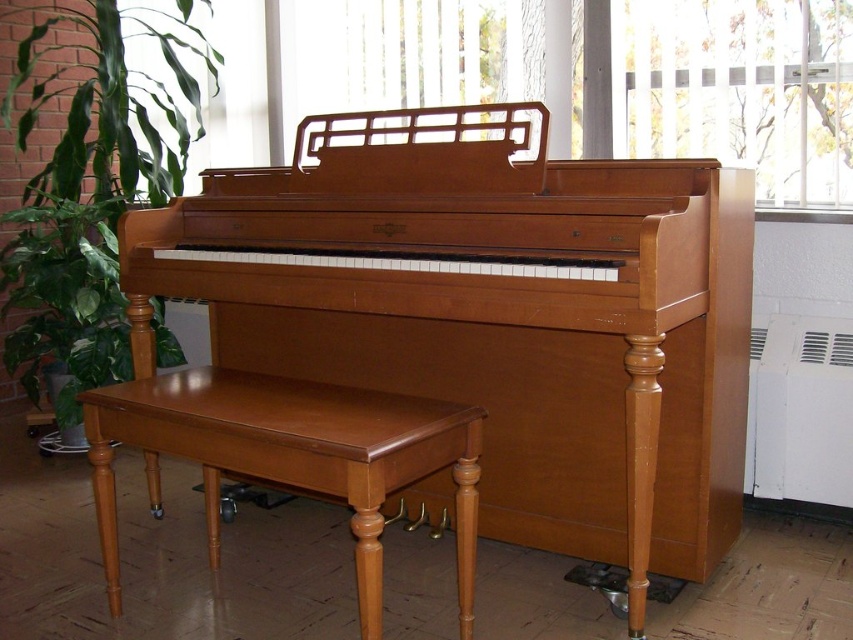
Question: Can you confirm if light brown polished wood piano at center is positioned above brown leather stool at lower left?

Choices:
 (A) yes
 (B) no

Answer: (A)

Question: Among these objects, which one is farthest from the camera?

Choices:
 (A) light brown polished wood piano at center
 (B) green leafy plant at left

Answer: (B)

Question: Is light brown polished wood piano at center further to camera compared to green leafy plant at left?

Choices:
 (A) no
 (B) yes

Answer: (A)

Question: Is green leafy plant at left further to the viewer compared to brown leather stool at lower left?

Choices:
 (A) no
 (B) yes

Answer: (B)

Question: Which of these objects is positioned closest to the light brown polished wood piano at center?

Choices:
 (A) green leafy plant at left
 (B) brown leather stool at lower left

Answer: (B)

Question: Based on their relative distances, which object is nearer to the brown leather stool at lower left?

Choices:
 (A) light brown polished wood piano at center
 (B) green leafy plant at left

Answer: (A)